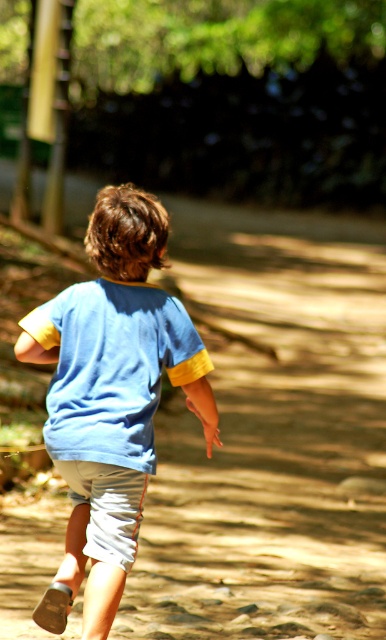
You are a photographer trying to capture the child in the image. Which clothing item, the blue cotton shirt at center or the white cotton shorts at lower center, would appear larger in the photo due to its position?

The blue cotton shirt at center appears larger in the photo because it is closer to the viewer than the white cotton shorts at lower center.

From the picture: You are a photographer trying to capture the child in the image. The blue cotton shirt at center and white cotton shorts at lower center are important for the shot. If your camera can focus on objects within a 7 inch range, will both items be in focus?

The distance between the blue cotton shirt at center and white cotton shorts at lower center is 8.61 inches. Since this exceeds the 7 inch focus range, both items cannot be in focus simultaneously.

Consider the image. Based on the scene, can you tell me which clothing item is positioned higher on the child? The blue cotton shirt at center or the white cotton shorts at lower center?

The blue cotton shirt at center is positioned higher than the white cotton shorts at lower center because it is described as being above it.